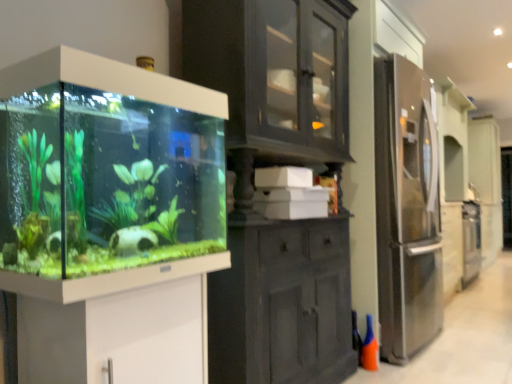
This screenshot has width=512, height=384. What do you see at coordinates (115, 323) in the screenshot?
I see `white glossy vanity at lower left` at bounding box center [115, 323].

Locate an element on the screen. This screenshot has width=512, height=384. transparent glass aquarium at left is located at coordinates (106, 166).

Identify the location of white glossy vanity at lower left. (115, 323).

Choose the correct answer: Is white glossy vanity at lower left inside transparent glass aquarium at left or outside it?

white glossy vanity at lower left is not enclosed by transparent glass aquarium at left.

From a real-world perspective, is white glossy vanity at lower left physically above transparent glass aquarium at left?

No, from a real-world perspective, white glossy vanity at lower left is not above transparent glass aquarium at left.

This screenshot has height=384, width=512. Identify the location of glass box on the right side of white glossy vanity at lower left. (106, 166).

Can you confirm if white glossy vanity at lower left is thinner than transparent glass aquarium at left?

No.

From the image's perspective, is orange matte cone at lower right on white glossy vanity at lower left?

Answer: Incorrect, from the image's perspective, orange matte cone at lower right is lower than white glossy vanity at lower left.

Is orange matte cone at lower right further to camera compared to white glossy vanity at lower left?

Yes, it is behind white glossy vanity at lower left.

From a real-world perspective, between orange matte cone at lower right and white glossy vanity at lower left, who is vertically higher?

white glossy vanity at lower left.

Which point is more distant from viewer, (364, 355) or (134, 338)?

The point (364, 355) is more distant.

In terms of size, does transparent glass aquarium at left appear bigger or smaller than orange matte cone at lower right?

Considering their sizes, transparent glass aquarium at left takes up more space than orange matte cone at lower right.

The width and height of the screenshot is (512, 384). In order to click on glass box that appears on the left of orange matte cone at lower right in this screenshot , I will do `click(106, 166)`.

From a real-world perspective, is transparent glass aquarium at left positioned above or below orange matte cone at lower right?

Clearly, from a real-world perspective, transparent glass aquarium at left is above orange matte cone at lower right.

Is the position of transparent glass aquarium at left more distant than that of orange matte cone at lower right?

No, the depth of transparent glass aquarium at left is less than that of orange matte cone at lower right.

The image size is (512, 384). Find the location of `glass box above the white glossy vanity at lower left (from the image's perspective)`. glass box above the white glossy vanity at lower left (from the image's perspective) is located at coordinates (106, 166).

From the image's perspective, between transparent glass aquarium at left and white glossy vanity at lower left, who is located below?

white glossy vanity at lower left.

Can you confirm if transparent glass aquarium at left is shorter than white glossy vanity at lower left?

No, transparent glass aquarium at left is not shorter than white glossy vanity at lower left.

Would you say orange matte cone at lower right is outside transparent glass aquarium at left?

orange matte cone at lower right is positioned outside transparent glass aquarium at left.

Does orange matte cone at lower right have a greater height compared to transparent glass aquarium at left?

No, orange matte cone at lower right is not taller than transparent glass aquarium at left.

From a real-world perspective, is orange matte cone at lower right positioned above or below transparent glass aquarium at left?

From a real-world perspective, orange matte cone at lower right is physically below transparent glass aquarium at left.

Is orange matte cone at lower right at the left side of transparent glass aquarium at left?

Incorrect, orange matte cone at lower right is not on the left side of transparent glass aquarium at left.

From a real-world perspective, which is physically above, white glossy vanity at lower left or orange matte cone at lower right?

From a 3D spatial view, white glossy vanity at lower left is above.

Is white glossy vanity at lower left facing away from orange matte cone at lower right?

white glossy vanity at lower left is not turned away from orange matte cone at lower right.

Which of these two, white glossy vanity at lower left or orange matte cone at lower right, is bigger?

Bigger between the two is white glossy vanity at lower left.

Locate an element on the screen. glass box that is on the right side of white glossy vanity at lower left is located at coordinates (106, 166).

The image size is (512, 384). Find the location of `cone below the white glossy vanity at lower left (from the image's perspective)`. cone below the white glossy vanity at lower left (from the image's perspective) is located at coordinates (369, 348).

Which object lies nearer to the anchor point white glossy vanity at lower left, orange matte cone at lower right or transparent glass aquarium at left?

Among the two, transparent glass aquarium at left is located nearer to white glossy vanity at lower left.

In the scene shown: Based on their spatial positions, is white glossy vanity at lower left or transparent glass aquarium at left further from orange matte cone at lower right?

The object further to orange matte cone at lower right is transparent glass aquarium at left.

Based on their spatial positions, is white glossy vanity at lower left or orange matte cone at lower right further from transparent glass aquarium at left?

orange matte cone at lower right.

From the image, which object appears to be farther from transparent glass aquarium at left, orange matte cone at lower right or white glossy vanity at lower left?

orange matte cone at lower right is positioned further to the anchor transparent glass aquarium at left.

Looking at this image, estimate the real-world distances between objects in this image. Which object is closer to orange matte cone at lower right, transparent glass aquarium at left or white glossy vanity at lower left?

Based on the image, white glossy vanity at lower left appears to be nearer to orange matte cone at lower right.

Based on their spatial positions, is transparent glass aquarium at left or orange matte cone at lower right further from white glossy vanity at lower left?

Among the two, orange matte cone at lower right is located further to white glossy vanity at lower left.

Where is `vanity located between transparent glass aquarium at left and orange matte cone at lower right in the depth direction`? This screenshot has height=384, width=512. vanity located between transparent glass aquarium at left and orange matte cone at lower right in the depth direction is located at coordinates (115, 323).